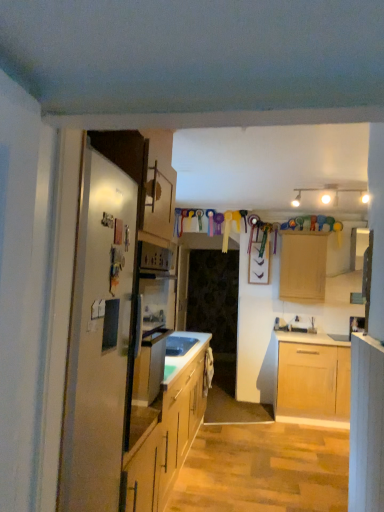
Question: Is white glossy sink at center situated inside satin silver refrigerator at left or outside?

Choices:
 (A) inside
 (B) outside

Answer: (B)

Question: From a real-world perspective, is white glossy sink at center positioned above or below satin silver refrigerator at left?

Choices:
 (A) below
 (B) above

Answer: (A)

Question: Estimate the real-world distances between objects in this image. Which object is farther from the light wood cabinet at upper center, which is counted as the first cabinetry, starting from the right?

Choices:
 (A) light wood cabinet at right, the second cabinetry viewed from the back
 (B) white glossy sink at center
 (C) transparent glass door at center
 (D) satin silver refrigerator at left

Answer: (D)

Question: Based on their relative distances, which object is farther from the transparent glass door at center?

Choices:
 (A) satin silver refrigerator at left
 (B) white glossy sink at center
 (C) light wood cabinet at right, acting as the 2th cabinetry starting from the right
 (D) light wood cabinet at upper center, which is counted as the first cabinetry, starting from the right

Answer: (A)